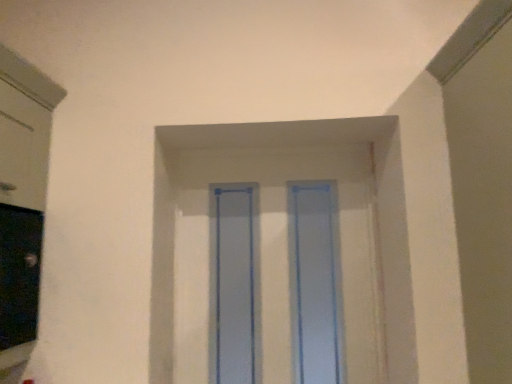
Where is `transparent plastic glass door at center`? This screenshot has width=512, height=384. transparent plastic glass door at center is located at coordinates (315, 282).

Describe the element at coordinates (315, 282) in the screenshot. I see `transparent plastic glass door at center` at that location.

Image resolution: width=512 pixels, height=384 pixels. What are the coordinates of `transparent plastic window frame at center` in the screenshot? It's located at (281, 254).

Describe the element at coordinates (281, 254) in the screenshot. I see `transparent plastic window frame at center` at that location.

Where is `transparent plastic glass door at center`? The height and width of the screenshot is (384, 512). transparent plastic glass door at center is located at coordinates (315, 282).

Can you confirm if transparent plastic glass door at center is positioned to the right of transparent plastic window frame at center?

No, transparent plastic glass door at center is not to the right of transparent plastic window frame at center.

Relative to transparent plastic window frame at center, is transparent plastic glass door at center in front or behind?

Visually, transparent plastic glass door at center is located in front of transparent plastic window frame at center.

Which is less distant, (322,261) or (335,293)?

Point (322,261) appears to be farther away from the viewer than point (335,293).

From the image's perspective, which object appears higher, transparent plastic glass door at center or transparent plastic window frame at center?

transparent plastic glass door at center, from the image's perspective.

From a real-world perspective, which is physically below, transparent plastic glass door at center or transparent plastic window frame at center?

In real-world perspective, transparent plastic window frame at center is lower.

In terms of width, does transparent plastic glass door at center look wider or thinner when compared to transparent plastic window frame at center?

In the image, transparent plastic glass door at center appears to be wider than transparent plastic window frame at center.

Considering the sizes of transparent plastic glass door at center and transparent plastic window frame at center in the image, is transparent plastic glass door at center taller or shorter than transparent plastic window frame at center?

Clearly, transparent plastic glass door at center is taller compared to transparent plastic window frame at center.

From the picture: Considering the sizes of objects transparent plastic glass door at center and transparent plastic window frame at center in the image provided, who is smaller, transparent plastic glass door at center or transparent plastic window frame at center?

transparent plastic window frame at center.

Could transparent plastic window frame at center be considered to be inside transparent plastic glass door at center?

Yes, transparent plastic glass door at center contains transparent plastic window frame at center.

In the scene shown: Is transparent plastic glass door at center not near transparent plastic window frame at center?

They are positioned close to each other.

Is transparent plastic glass door at center looking in the opposite direction of transparent plastic window frame at center?

Yes, transparent plastic window frame at center is at the back of transparent plastic glass door at center.

How different are the orientations of transparent plastic glass door at center and transparent plastic window frame at center in degrees?

There is a 0.000495-degree angle between the facing directions of transparent plastic glass door at center and transparent plastic window frame at center.

Could you measure the distance between transparent plastic glass door at center and transparent plastic window frame at center?

8.11 centimeters.

I want to click on window frame below the transparent plastic glass door at center (from the image's perspective), so click(281, 254).

Considering the positions of objects transparent plastic window frame at center and transparent plastic glass door at center in the image provided, who is more to the right, transparent plastic window frame at center or transparent plastic glass door at center?

Positioned to the right is transparent plastic window frame at center.

Is the depth of transparent plastic window frame at center greater than that of transparent plastic glass door at center?

Yes, it is behind transparent plastic glass door at center.

Between point (383, 365) and point (319, 382), which one is positioned behind?

The point (319, 382) is farther.

From the image's perspective, is transparent plastic window frame at center below transparent plastic glass door at center?

Yes, from the image's perspective, transparent plastic window frame at center is beneath transparent plastic glass door at center.

From a real-world perspective, is transparent plastic window frame at center positioned over transparent plastic glass door at center based on gravity?

No, from a real-world perspective, transparent plastic window frame at center is not above transparent plastic glass door at center.

Can you confirm if transparent plastic window frame at center is wider than transparent plastic glass door at center?

Incorrect, the width of transparent plastic window frame at center does not surpass that of transparent plastic glass door at center.

Who is shorter, transparent plastic window frame at center or transparent plastic glass door at center?

A: transparent plastic window frame at center is shorter.

Does transparent plastic window frame at center have a larger size compared to transparent plastic glass door at center?

Actually, transparent plastic window frame at center might be smaller than transparent plastic glass door at center.

Based on the photo, is transparent plastic window frame at center completely or partially outside of transparent plastic glass door at center?

No, transparent plastic window frame at center is inside transparent plastic glass door at center's boundary.

Is the surface of transparent plastic window frame at center in direct contact with transparent plastic glass door at center?

Yes, transparent plastic window frame at center is touching transparent plastic glass door at center.

Is transparent plastic glass door at center at the back of transparent plastic window frame at center?

Absolutely, transparent plastic window frame at center is directed away from transparent plastic glass door at center.

The width and height of the screenshot is (512, 384). Identify the location of glass door in front of the transparent plastic window frame at center. (315, 282).

I want to click on glass door above the transparent plastic window frame at center (from a real-world perspective), so click(x=315, y=282).

Find the location of a particular element. window frame behind the transparent plastic glass door at center is located at coordinates (281, 254).